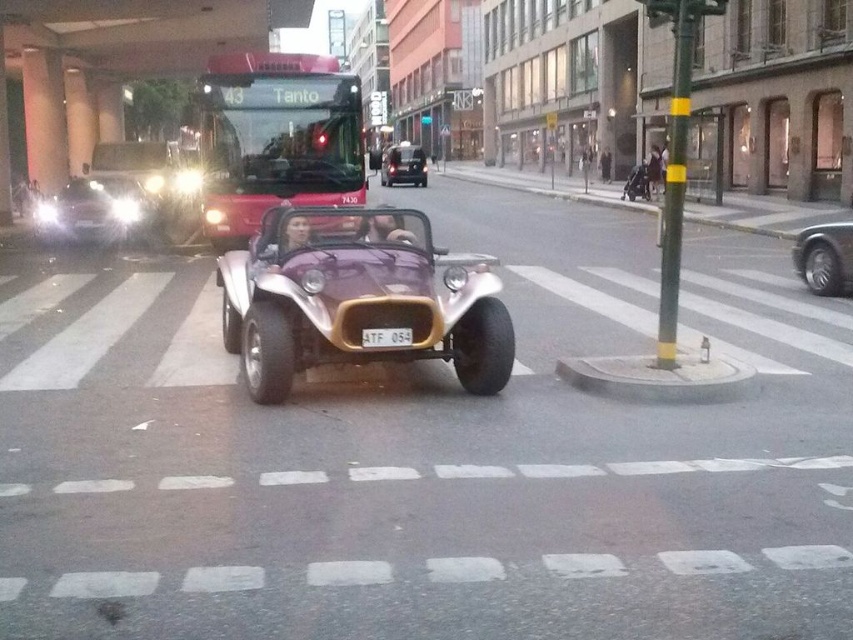
Question: Which point appears farthest from the camera in this image?

Choices:
 (A) (381, 348)
 (B) (848, 256)
 (C) (476, 278)

Answer: (B)

Question: Estimate the real-world distances between objects in this image. Which object is closer to the metallic red bus at center?

Choices:
 (A) shiny silver car at left
 (B) metallic purple car at center
 (C) purple metallic car at center

Answer: (A)

Question: Is purple metallic car at center in front of shiny silver car at left?

Choices:
 (A) no
 (B) yes

Answer: (B)

Question: Which point is closer to the camera taking this photo?

Choices:
 (A) (369, 332)
 (B) (813, 252)

Answer: (A)

Question: In this image, where is purple metallic car at center located relative to shiny black car at center?

Choices:
 (A) left
 (B) right

Answer: (A)

Question: In this image, where is shiny black car at center located relative to metallic purple car at center?

Choices:
 (A) above
 (B) below

Answer: (B)